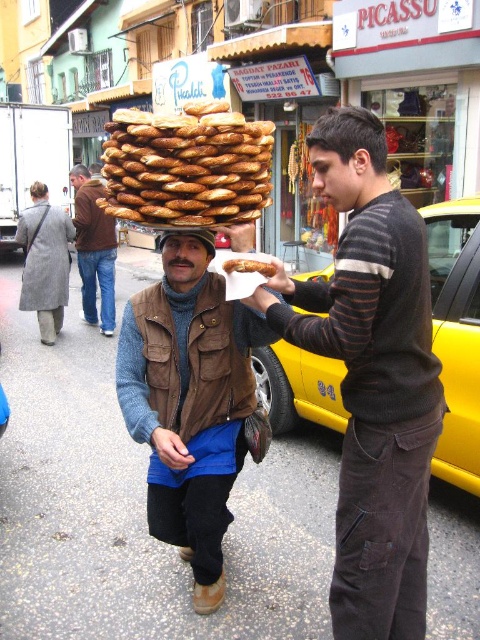
Question: Which is nearer to the brown/crumbly bread at center?

Choices:
 (A) dark brown hair at upper left
 (B) yellow metallic taxi at right
 (C) brown leather jacket at center
 (D) smooth brown hair at center

Answer: (D)

Question: Which point appears closest to the camera in this image?

Choices:
 (A) (40, 188)
 (B) (266, 262)
 (C) (160, 246)

Answer: (B)

Question: Can you confirm if gray wool coat at center is positioned to the right of brown leather jacket at center?

Choices:
 (A) no
 (B) yes

Answer: (A)

Question: From the image, what is the correct spatial relationship of smooth brown hair at center in relation to dark brown hair at upper left?

Choices:
 (A) below
 (B) above

Answer: (A)

Question: Is brown/crumbly bread at center in front of brown leather hat at center?

Choices:
 (A) yes
 (B) no

Answer: (A)

Question: Which of the following is the farthest from the observer?

Choices:
 (A) (230, 172)
 (B) (90, 177)
 (C) (371, 166)

Answer: (B)